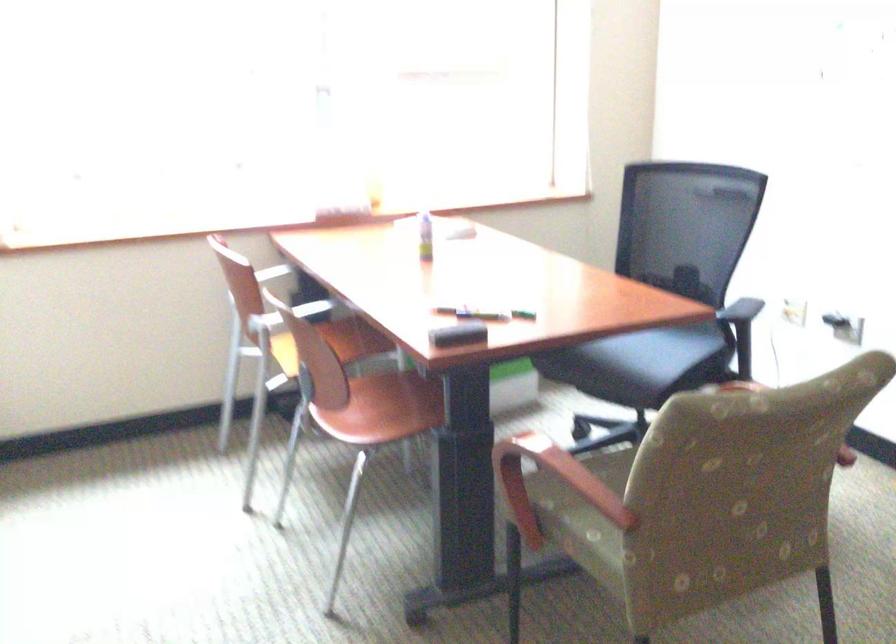
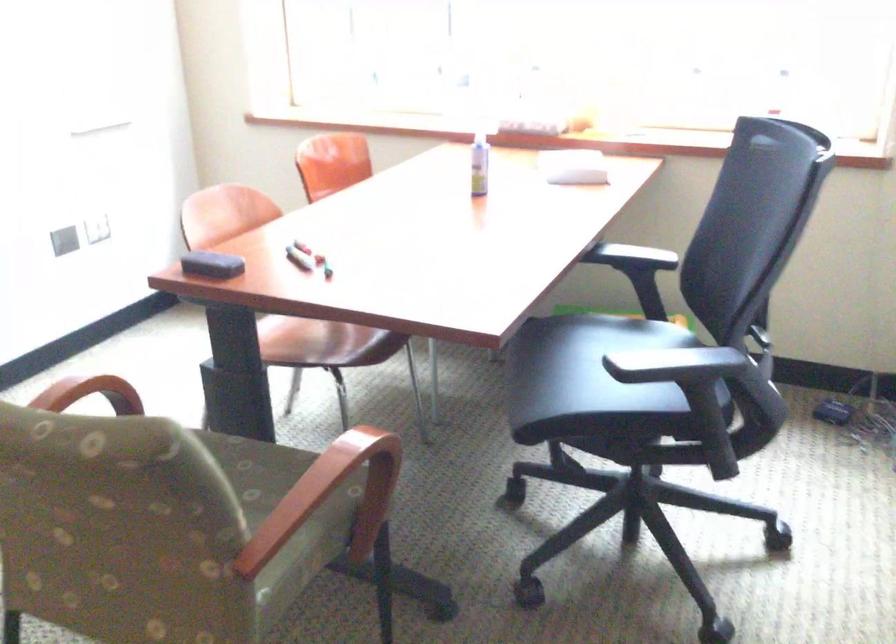
Question: I am providing you with two images of the same scene from different viewpoints. Which of the following objects are not visible in image2?

Choices:
 (A) chair sitting surface
 (B) black board eraser
 (C) black coffee cup
 (D) white spray bottle

Answer: (A)